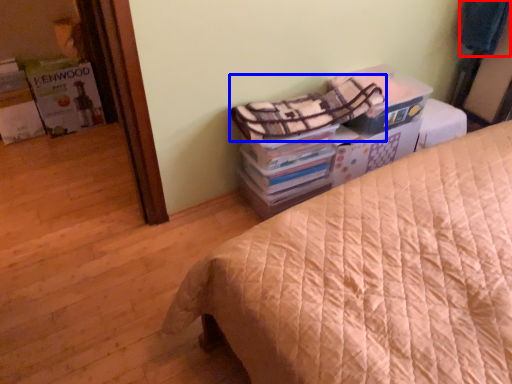
Question: Which object is closer to the camera taking this photo, blanket (highlighted by a red box) or blanket (highlighted by a blue box)?

Choices:
 (A) blanket
 (B) blanket

Answer: (B)